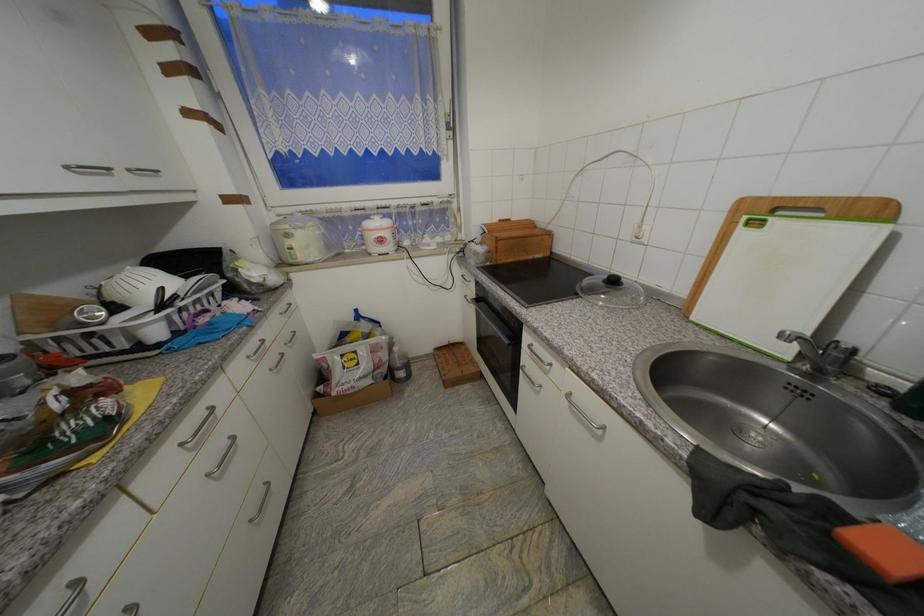
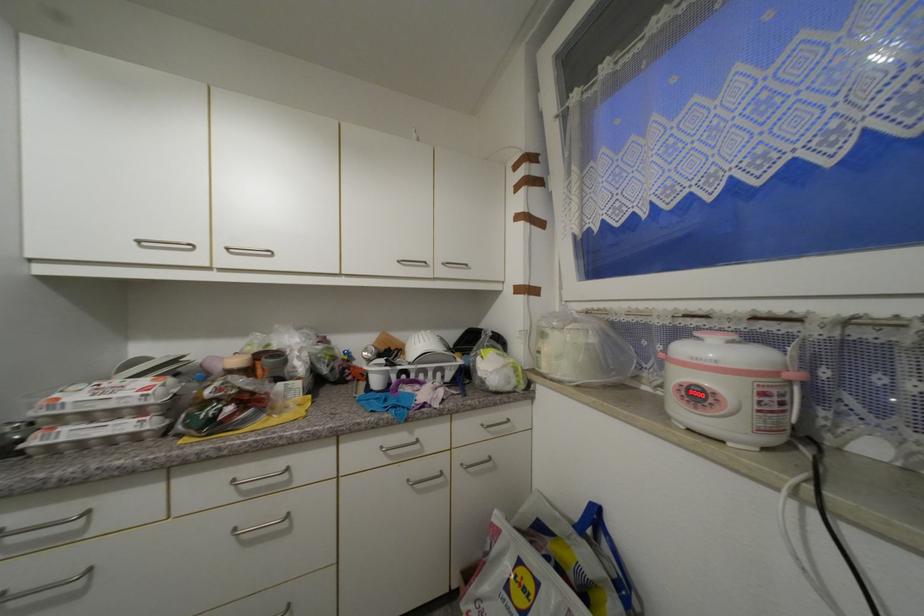
In the second image, find the point that corresponds to [286,315] in the first image.

(488, 427)